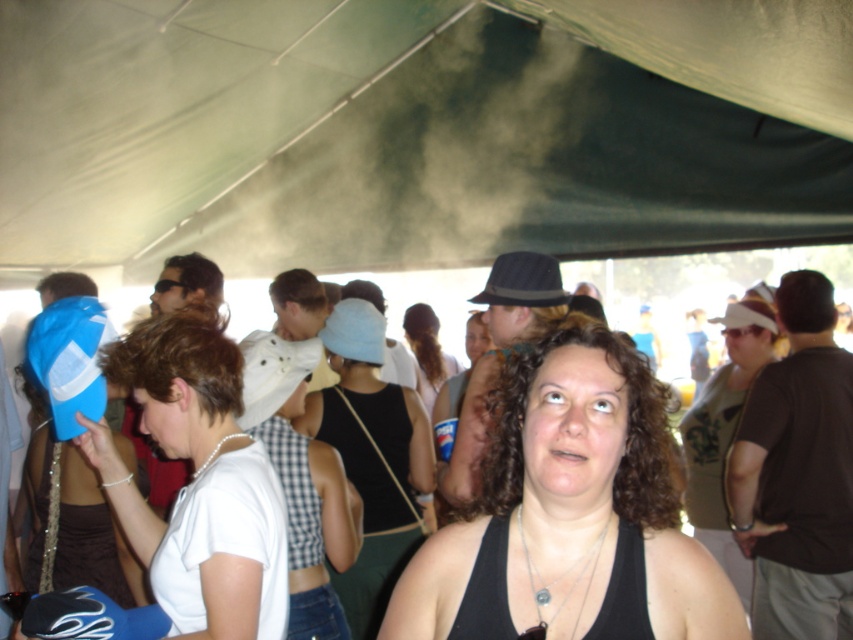
Question: Which of the following is the closest to the observer?

Choices:
 (A) white checkered tank top at center
 (B) white matte baseball cap at left
 (C) matte white tank top at center

Answer: (B)

Question: Does matte white tank top at center appear on the left side of white fabric hat at center?

Choices:
 (A) yes
 (B) no

Answer: (B)

Question: Which point is farther to the camera?

Choices:
 (A) (741, 634)
 (B) (193, 588)
 (C) (741, 312)
 (D) (270, 344)

Answer: (C)

Question: Can you confirm if white matte baseball cap at left is wider than white checkered tank top at center?

Choices:
 (A) no
 (B) yes

Answer: (B)

Question: Is white matte baseball cap at left below white checkered tank top at center?

Choices:
 (A) yes
 (B) no

Answer: (B)

Question: Which point appears farthest from the camera in this image?

Choices:
 (A) (508, 552)
 (B) (735, 317)

Answer: (B)